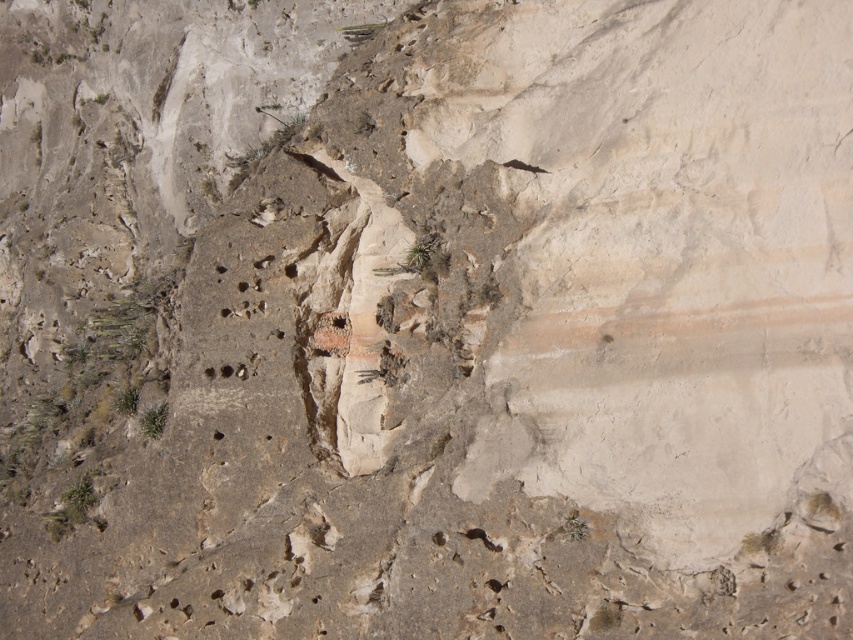
Question: Observing the image, what is the correct spatial positioning of smooth sandstone hole at lower center in reference to smooth stone hole at center?

Choices:
 (A) left
 (B) right

Answer: (B)

Question: Which of the following is the closest to the observer?

Choices:
 (A) smooth stone hole at center
 (B) smooth sandstone hole at lower center

Answer: (B)

Question: Which of the following is the closest to the observer?

Choices:
 (A) smooth stone hole at center
 (B) smooth sandstone hole at lower center

Answer: (B)

Question: Does smooth sandstone hole at lower center appear under smooth stone hole at center?

Choices:
 (A) no
 (B) yes

Answer: (A)

Question: In this image, where is smooth sandstone hole at lower center located relative to smooth stone hole at center?

Choices:
 (A) below
 (B) above

Answer: (B)